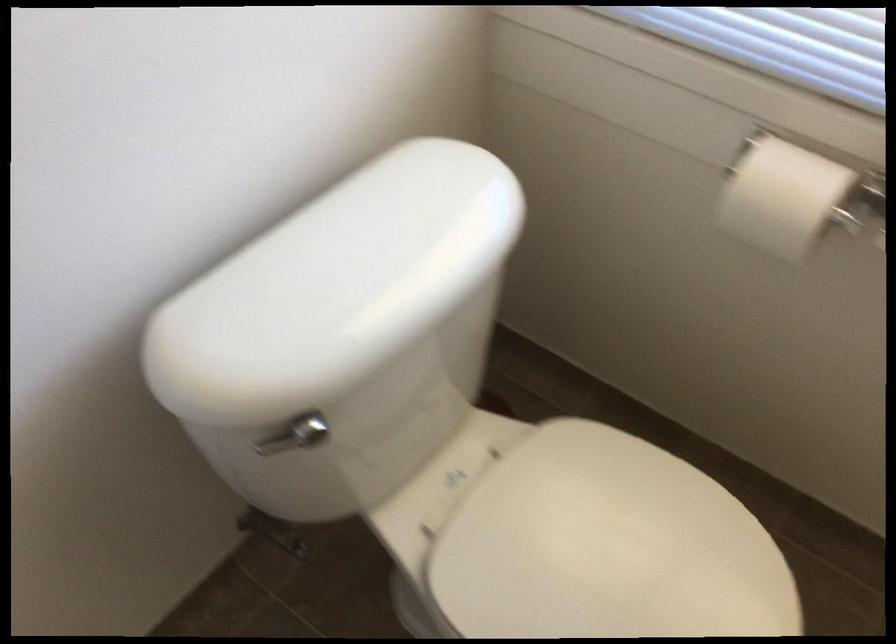
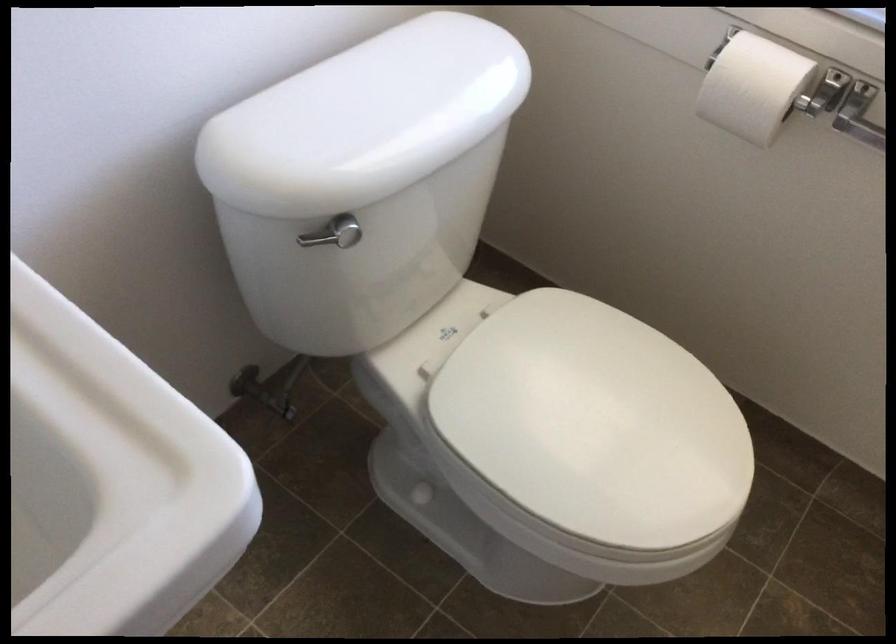
Locate, in the second image, the point that corresponds to [326,296] in the first image.

(365, 118)